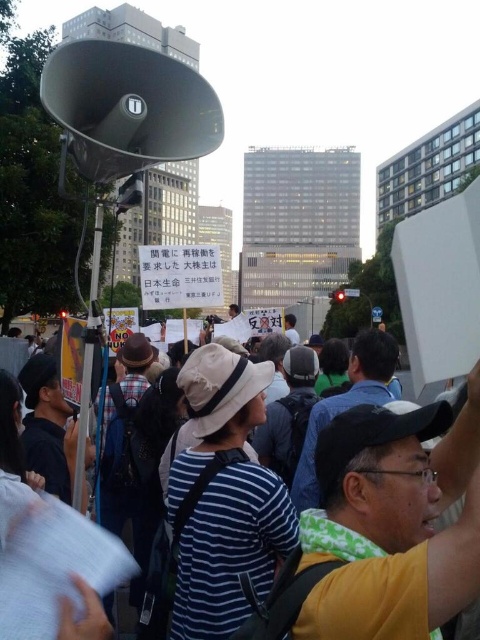
Consider the image. You are a speaker at the protest and need to ensure everyone can hear your speech. Given that the matte gray megaphone at upper left is positioned above the striped fabric crowd at lower center, where should you stand relative to these objects to maximize the megaphone sound coverage?

You should stand near the matte gray megaphone at upper left since it is positioned above the striped fabric crowd at lower center, allowing the sound to project downward toward the crowd effectively.

In the scene shown: You are a photographer trying to capture a photo of the matte gray megaphone at upper left without the striped fabric crowd at lower center blocking it. Based on their positions, is this possible?

The striped fabric crowd at lower center is closer to the viewer than the matte gray megaphone at upper left, so the crowd would block the view of the megaphone. It is not possible to capture the megaphone without the crowd blocking it.

Looking at this image, based on the scene description, which object occupies more space in the image? The striped fabric crowd at lower center or the matte gray megaphone at upper left?

The striped fabric crowd at lower center is larger in size than the matte gray megaphone at upper left, so it occupies more space in the image.